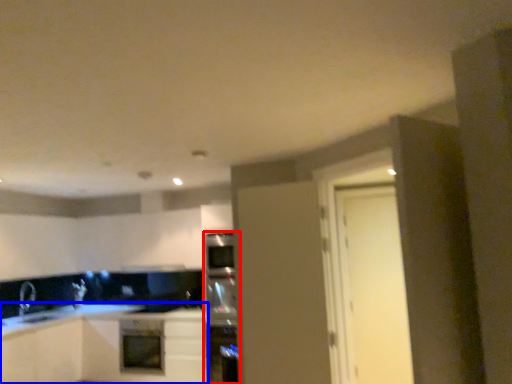
Question: Which object is further to the camera taking this photo, appliance (highlighted by a red box) or cabinetry (highlighted by a blue box)?

Choices:
 (A) appliance
 (B) cabinetry

Answer: (B)